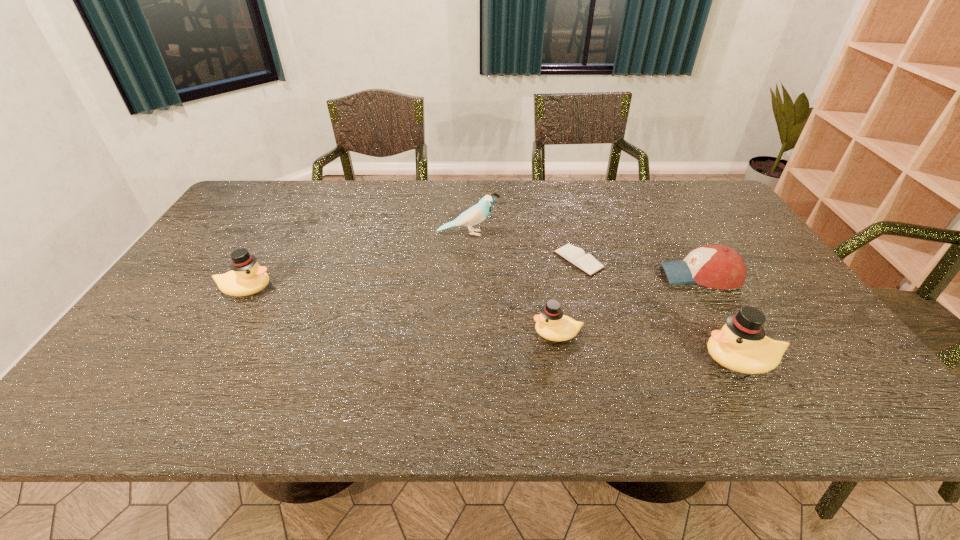
The height and width of the screenshot is (540, 960). I want to click on object that is at the left edge, so click(x=247, y=277).

At what (x,y) coordinates should I click in order to perform the action: click on duck present at the right edge. Please return your answer as a coordinate pair (x, y). The width and height of the screenshot is (960, 540). Looking at the image, I should click on pos(741,345).

This screenshot has width=960, height=540. I want to click on baseball cap located at the right edge, so coord(720,267).

Where is `object at the near right corner`? The width and height of the screenshot is (960, 540). object at the near right corner is located at coordinates (741, 345).

What are the coordinates of `free location at the far edge of the desktop` in the screenshot? It's located at (319, 216).

The width and height of the screenshot is (960, 540). I want to click on blank area at the near edge, so (x=545, y=363).

Identify the location of vacant region at the left edge of the desktop. (219, 226).

This screenshot has width=960, height=540. In the image, there is a desktop. Identify the location of vacant space at the right edge. (773, 301).

Where is `free location at the near left corner`? This screenshot has height=540, width=960. free location at the near left corner is located at coordinates (147, 358).

Image resolution: width=960 pixels, height=540 pixels. Identify the location of vacant area at the far right corner. (x=683, y=211).